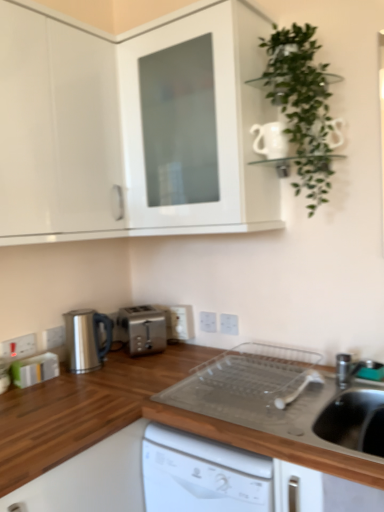
What do you see at coordinates (86, 339) in the screenshot? Image resolution: width=384 pixels, height=512 pixels. I see `satin silver kettle at lower left` at bounding box center [86, 339].

What is the approximate width of white glossy cabinet at upper left, which is counted as the 1th cabinetry, starting from the left?

It is 13.43 inches.

Measure the distance between green leafy plant at upper right and camera.

green leafy plant at upper right and camera are 4.59 feet apart.

This screenshot has height=512, width=384. Find the location of `green leafy plant at upper right`. green leafy plant at upper right is located at coordinates (301, 106).

The width and height of the screenshot is (384, 512). What do you see at coordinates (229, 324) in the screenshot?
I see `white plastic electric outlet at center, which is the third electric outlet from front to back` at bounding box center [229, 324].

Locate an element on the screen. white glossy cabinet at upper center, the 2th cabinetry positioned from the left is located at coordinates (132, 129).

What do you see at coordinates (180, 322) in the screenshot? This screenshot has width=384, height=512. I see `white plastic electric outlet at center, which ranks as the third electric outlet in left-to-right order` at bounding box center [180, 322].

This screenshot has width=384, height=512. I want to click on satin silver kettle at lower left, so click(86, 339).

Considering the relative positions of white plastic electric outlet at center, which is the second electric outlet from back to front, and white plastic electric outlet at lower left, the 4th electric outlet from the right, in the image provided, is white plastic electric outlet at center, which is the second electric outlet from back to front, to the left or to the right of white plastic electric outlet at lower left, the 4th electric outlet from the right,?

From the image, it's evident that white plastic electric outlet at center, which is the second electric outlet from back to front, is to the right of white plastic electric outlet at lower left, the 4th electric outlet from the right.

From the image's perspective, is white plastic electric outlet at center, which is counted as the 4th electric outlet, starting from the left, below white plastic electric outlet at lower left, arranged as the fourth electric outlet when viewed from the back?

Incorrect, from the image's perspective, white plastic electric outlet at center, which is counted as the 4th electric outlet, starting from the left, is higher than white plastic electric outlet at lower left, arranged as the fourth electric outlet when viewed from the back.

Between white plastic electric outlet at center, placed as the 4th electric outlet when sorted from front to back, and white plastic electric outlet at lower left, arranged as the fourth electric outlet when viewed from the back, which one has smaller size?

With smaller size is white plastic electric outlet at lower left, arranged as the fourth electric outlet when viewed from the back.

Who is taller, white plastic electric outlet at center, which is counted as the 4th electric outlet, starting from the left, or white plastic electric outlet at lower left, which appears as the 2th electric outlet when viewed from the left?

With more height is white plastic electric outlet at lower left, which appears as the 2th electric outlet when viewed from the left.

Is white plastic electric outlet at center, marked as the 3th electric outlet in a right-to-left arrangement, outside of white plastic electric outlet at lower left, which is the fifth electric outlet in right-to-left order?

Absolutely, white plastic electric outlet at center, marked as the 3th electric outlet in a right-to-left arrangement, is external to white plastic electric outlet at lower left, which is the fifth electric outlet in right-to-left order.

Between white plastic electric outlet at center, which ranks as the third electric outlet in left-to-right order, and white plastic electric outlet at lower left, which is the fifth electric outlet in right-to-left order, which one has smaller width?

With smaller width is white plastic electric outlet at lower left, which is the fifth electric outlet in right-to-left order.

Is point (187, 329) closer to viewer compared to point (23, 353)?

No, it is behind (23, 353).

Is satin silver kettle at lower left next to green rubber tap at lower right?

satin silver kettle at lower left and green rubber tap at lower right are not in contact.

Is satin silver kettle at lower left facing towards green rubber tap at lower right?

Yes, satin silver kettle at lower left is turned towards green rubber tap at lower right.

Who is shorter, satin silver kettle at lower left or green rubber tap at lower right?

green rubber tap at lower right is shorter.

In the scene shown: Which object is positioned more to the right, satin silver kettle at lower left or green rubber tap at lower right?

green rubber tap at lower right is more to the right.

Between point (250, 390) and point (139, 326), which one is positioned in front?

The point (250, 390) is in front.

Is clear plastic sink at lower right not close to satin silver toaster at center?

No, clear plastic sink at lower right is in close proximity to satin silver toaster at center.

Looking at this image, between clear plastic sink at lower right and satin silver toaster at center, which one appears on the left side from the viewer's perspective?

satin silver toaster at center is more to the left.

From the image's perspective, is clear plastic sink at lower right located above or below satin silver toaster at center?

Based on their image positions, clear plastic sink at lower right is located beneath satin silver toaster at center.

Which object is closer to the camera, white glossy cabinet at upper left, which is counted as the 1th cabinetry, starting from the left, or green rubber tap at lower right?

white glossy cabinet at upper left, which is counted as the 1th cabinetry, starting from the left, is closer to the camera.

From the picture: Can you confirm if white glossy cabinet at upper left, the 2th cabinetry positioned from the right, is smaller than green rubber tap at lower right?

No.

From a real-world perspective, is white glossy cabinet at upper left, which is counted as the 1th cabinetry, starting from the left, physically above green rubber tap at lower right?

Yes, from a real-world perspective, white glossy cabinet at upper left, which is counted as the 1th cabinetry, starting from the left, is over green rubber tap at lower right

From the image's perspective, relative to green rubber tap at lower right, is white glossy cabinet at upper left, the 2th cabinetry positioned from the right, above or below?

From the image's perspective, white glossy cabinet at upper left, the 2th cabinetry positioned from the right, appears above green rubber tap at lower right.

Is satin silver toaster at center spatially inside white glossy cabinet at upper left, the 2th cabinetry positioned from the right, or outside of it?

satin silver toaster at center exists outside the volume of white glossy cabinet at upper left, the 2th cabinetry positioned from the right.

Is satin silver toaster at center wider than white glossy cabinet at upper left, the 2th cabinetry positioned from the right?

In fact, satin silver toaster at center might be narrower than white glossy cabinet at upper left, the 2th cabinetry positioned from the right.

Is satin silver toaster at center in front of white glossy cabinet at upper left, which is counted as the 1th cabinetry, starting from the left?

No, it is behind white glossy cabinet at upper left, which is counted as the 1th cabinetry, starting from the left.

Is green rubber tap at lower right placed right next to white glossy cabinet at upper left, the 2th cabinetry positioned from the right?

No, green rubber tap at lower right is not beside white glossy cabinet at upper left, the 2th cabinetry positioned from the right.

Is green rubber tap at lower right positioned in front of white glossy cabinet at upper left, the 2th cabinetry positioned from the right?

That is False.

From a real-world perspective, is green rubber tap at lower right over white glossy cabinet at upper left, the 2th cabinetry positioned from the right?

No, from a real-world perspective, green rubber tap at lower right is not on top of white glossy cabinet at upper left, the 2th cabinetry positioned from the right.

Looking at this image, from the image's perspective, is green rubber tap at lower right located above or below white glossy cabinet at upper left, which is counted as the 1th cabinetry, starting from the left?

Clearly, from the image's perspective, green rubber tap at lower right is below white glossy cabinet at upper left, which is counted as the 1th cabinetry, starting from the left.

Starting from the white plastic electric outlet at lower left, the 4th electric outlet from the right, which electric outlet is the 2nd one to the right? Please provide its 2D coordinates.

[(208, 322)]

This screenshot has height=512, width=384. I want to click on the 4th electric outlet in front when counting from the white plastic electric outlet at center, marked as the 3th electric outlet in a right-to-left arrangement, so click(x=18, y=346).

Looking at the image, which one is located closer to clear plastic sink at lower right, white glossy cabinet at upper center, which is the 1th cabinetry in right-to-left order, or white plastic electric outlet at lower left, arranged as the 2th electric outlet when viewed from the front?

The object closer to clear plastic sink at lower right is white glossy cabinet at upper center, which is the 1th cabinetry in right-to-left order.

Which object lies nearer to the anchor point white plastic electric outlet at center, which is the second electric outlet from back to front, white plastic electric outlet at center, the 5th electric outlet when ordered from front to back, or satin silver toaster at center?

white plastic electric outlet at center, the 5th electric outlet when ordered from front to back, is closer to white plastic electric outlet at center, which is the second electric outlet from back to front.

Considering their positions, is white glossy cabinet at upper left, which is counted as the 1th cabinetry, starting from the left, positioned closer to satin silver toaster at center than clear plastic sink at lower right?

Among the two, clear plastic sink at lower right is located nearer to satin silver toaster at center.

Which object lies further to the anchor point satin silver toaster at center, white glossy cabinet at upper center, which is the 1th cabinetry in right-to-left order, or white plastic electric outlet at lower left, which is the fifth electric outlet in right-to-left order?

Among the two, white glossy cabinet at upper center, which is the 1th cabinetry in right-to-left order, is located further to satin silver toaster at center.

Looking at the image, which one is located closer to satin silver toaster at center, white plastic electric outlet at lower left, the first electric outlet when ordered from left to right, or clear plastic sink at lower right?

Based on the image, white plastic electric outlet at lower left, the first electric outlet when ordered from left to right, appears to be nearer to satin silver toaster at center.

Which object lies further to the anchor point white plastic electric outlet at center, the second electric outlet viewed from the right, white plastic electric outlet at center, marked as the 3th electric outlet in a right-to-left arrangement, or satin silver kettle at lower left?

satin silver kettle at lower left is positioned further to the anchor white plastic electric outlet at center, the second electric outlet viewed from the right.

Considering their positions, is satin silver kettle at lower left positioned closer to white plastic electric outlet at center, placed as the 4th electric outlet when sorted from front to back, than white glossy cabinet at upper center, which is the 1th cabinetry in right-to-left order?

Based on the image, satin silver kettle at lower left appears to be nearer to white plastic electric outlet at center, placed as the 4th electric outlet when sorted from front to back.

Which object lies further to the anchor point white plastic electric outlet at lower left, the 4th electric outlet from the right, white plastic electric outlet at center, which is the third electric outlet from front to back, or white plastic electric outlet at center, which ranks as the third electric outlet in left-to-right order?

white plastic electric outlet at center, which is the third electric outlet from front to back, lies further to white plastic electric outlet at lower left, the 4th electric outlet from the right, than the other object.

The width and height of the screenshot is (384, 512). What are the coordinates of `home appliance that lies between white glossy cabinet at upper left, the 2th cabinetry positioned from the right, and clear plastic sink at lower right from top to bottom` in the screenshot? It's located at pos(86,339).

The image size is (384, 512). I want to click on home appliance located between white plastic electric outlet at lower left, the first electric outlet when ordered from front to back, and satin silver toaster at center in the left-right direction, so click(86, 339).

The height and width of the screenshot is (512, 384). I want to click on kitchen appliance between green leafy plant at upper right and green rubber tap at lower right in the vertical direction, so [x=143, y=328].

Identify the location of cabinetry located between satin silver kettle at lower left and green rubber tap at lower right in the left-right direction. The height and width of the screenshot is (512, 384). (132, 129).